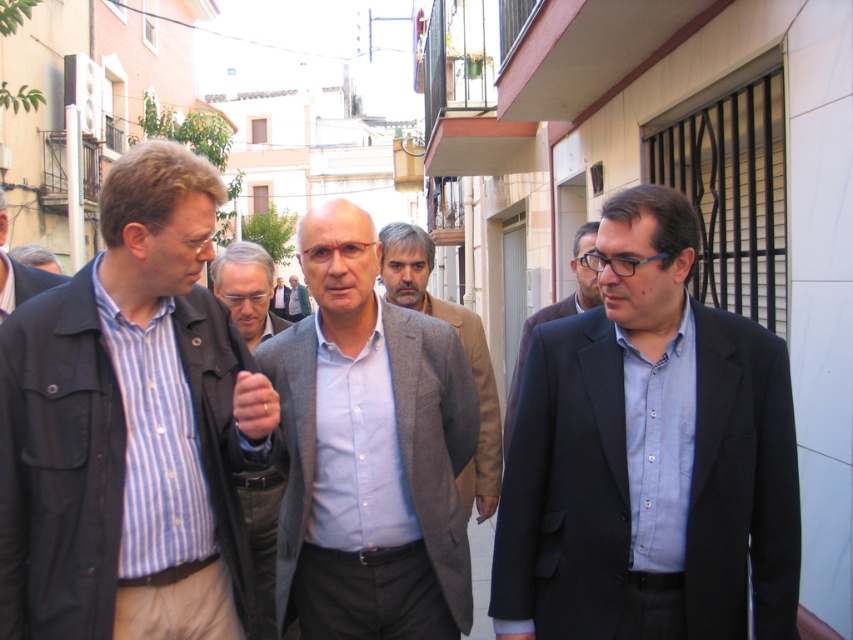
In the scene of a Mediterranean alleyway, there are two people dressed formally. The first person is wearing a dark gray suit at center, and the second is wearing a light blue shirt at center. Which clothing item takes up more space in the image?

The light blue shirt at center takes up more space in the image because it is larger than the dark gray suit at center according to the description.

You are a photographer standing in the narrow street. You want to take a photo of the light brown woolen jacket at center and the dark suit jacket and light blue shirt to the right. How far apart are the two jackets?

The two jackets are 12.05 feet apart.

You are a photographer trying to capture the dark gray suit at center in the image. Based on its position coordinates, which part of the image should you focus on?

The dark gray suit at center is located at coordinates point [18,273], so you should focus on that point to capture it.